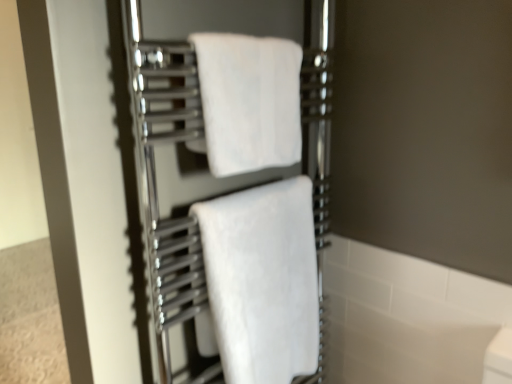
Locate an element on the screen. free point below white soft towel at center, the first towel viewed from the top (from a real-world perspective) is located at coordinates (246, 194).